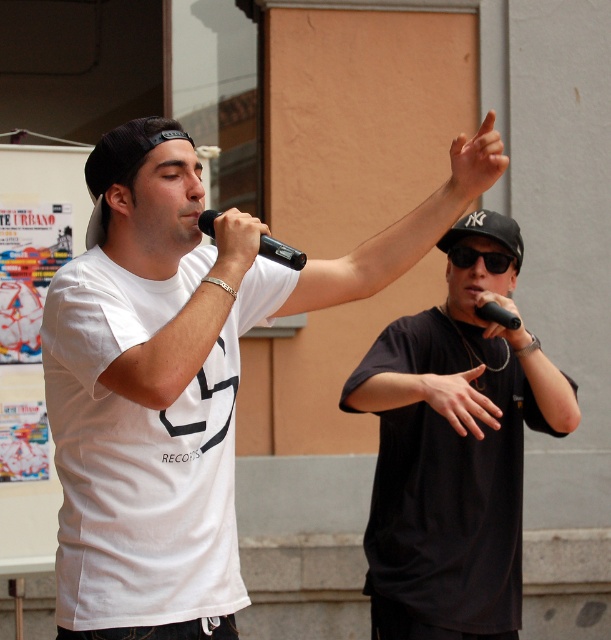
Question: Estimate the real-world distances between objects in this image. Which object is farther from the skinny black hand at upper right?

Choices:
 (A) black fabric baseball cap at upper right
 (B) white matte t-shirt at center
 (C) white cotton t-shirt at center

Answer: (C)

Question: Can you confirm if black fabric baseball cap at upper right is smaller than black matte microphone at right?

Choices:
 (A) yes
 (B) no

Answer: (B)

Question: Does white matte t-shirt at center appear over smooth skin hand at center?

Choices:
 (A) no
 (B) yes

Answer: (B)

Question: Which point is farther to the camera?

Choices:
 (A) (466, 180)
 (B) (431, 400)
 (C) (508, 328)

Answer: (C)

Question: Is skinny black hand at upper right above black matte microphone at center?

Choices:
 (A) yes
 (B) no

Answer: (A)

Question: Estimate the real-world distances between objects in this image. Which object is farther from the black matte t-shirt at center?

Choices:
 (A) skinny black hand at upper right
 (B) black matte microphone at right
 (C) black fabric baseball cap at upper right
 (D) white matte t-shirt at center

Answer: (A)